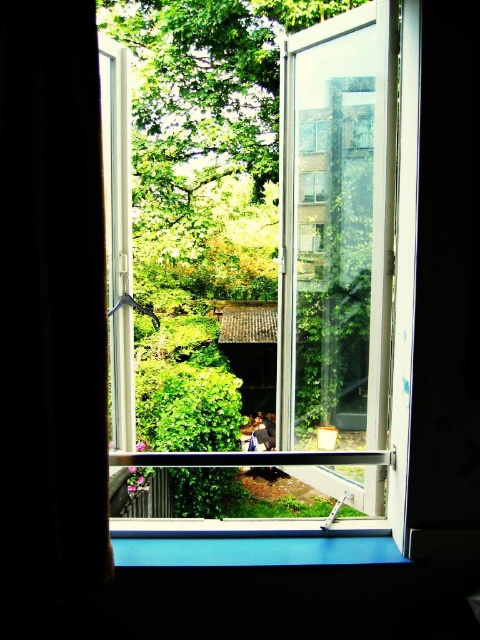
Question: Which of the following is the farthest from the observer?

Choices:
 (A) (312, 154)
 (B) (252, 38)

Answer: (B)

Question: Observing the image, what is the correct spatial positioning of black fabric curtain at left in reference to green leafy tree at center?

Choices:
 (A) below
 (B) above

Answer: (A)

Question: Among these objects, which one is nearest to the camera?

Choices:
 (A) clear glass window at center
 (B) green leafy tree at center
 (C) black fabric curtain at left

Answer: (C)

Question: In this image, where is clear glass window at center located relative to green leafy tree at center?

Choices:
 (A) right
 (B) left

Answer: (A)

Question: Which of the following is the closest to the observer?

Choices:
 (A) black fabric curtain at left
 (B) green leafy tree at center

Answer: (A)

Question: Does clear glass window at center have a greater width compared to black fabric curtain at left?

Choices:
 (A) no
 (B) yes

Answer: (B)